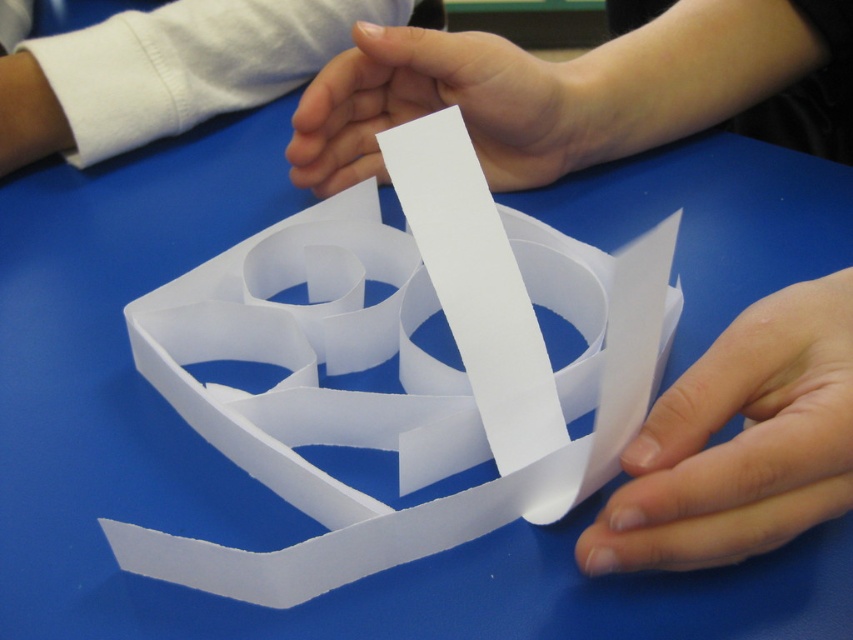
Question: Is white paper at upper center to the right of white clothed arm at upper left from the viewer's perspective?

Choices:
 (A) no
 (B) yes

Answer: (B)

Question: Does smooth white finger at center have a lesser width compared to white clothed arm at upper left?

Choices:
 (A) no
 (B) yes

Answer: (B)

Question: Is the position of smooth white finger at center less distant than that of white paper at center?

Choices:
 (A) yes
 (B) no

Answer: (A)

Question: Which point is closer to the camera?

Choices:
 (A) white clothed arm at upper left
 (B) smooth white finger at center
 (C) white paper at center

Answer: (B)

Question: Which object is farther from the camera taking this photo?

Choices:
 (A) white paper at center
 (B) white clothed arm at upper left
 (C) smooth white finger at center

Answer: (B)

Question: Which point is farther to the camera?

Choices:
 (A) smooth white finger at center
 (B) white paper at upper center
 (C) white paper at center
 (D) white clothed arm at upper left

Answer: (D)